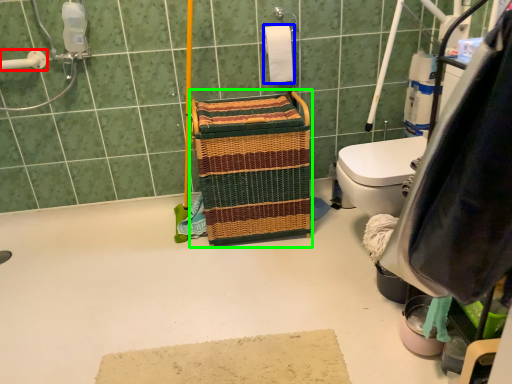
Question: Which object is the farthest from shower (highlighted by a red box)? Choose among these: toilet paper (highlighted by a blue box) or laundry basket (highlighted by a green box).

Choices:
 (A) toilet paper
 (B) laundry basket

Answer: (A)